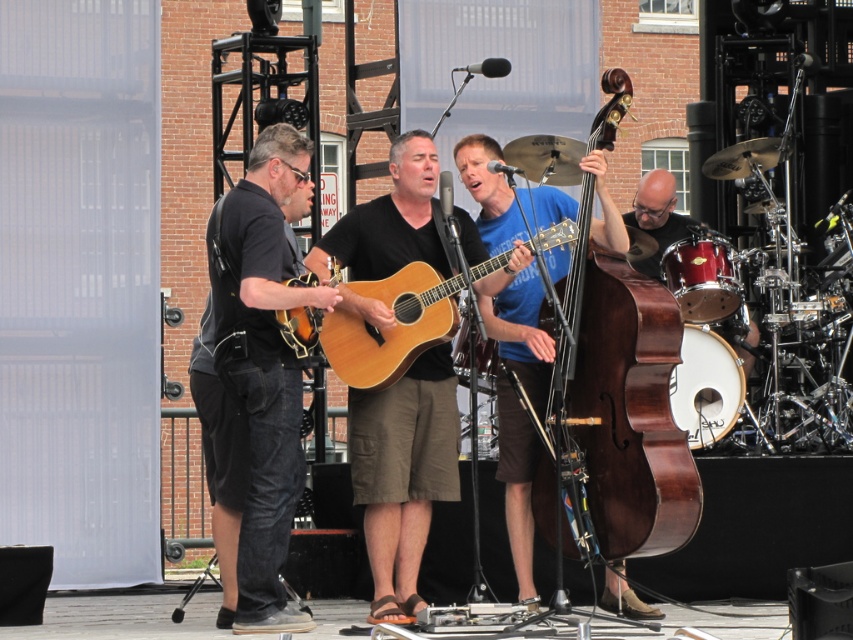
Does natural wood acoustic guitar at center come behind shiny black drum at right?

No, it is not.

Consider the image. Who is positioned more to the left, natural wood acoustic guitar at center or shiny black drum at right?

Positioned to the left is natural wood acoustic guitar at center.

The height and width of the screenshot is (640, 853). In order to click on natural wood acoustic guitar at center in this screenshot , I will do [x=393, y=326].

Is point (606, 115) behind point (259, 211)?

That is True.

Between brown polished wood cello at right and denim jeans at left, which one appears on the left side from the viewer's perspective?

denim jeans at left

Who is more distant from viewer, (x=628, y=294) or (x=286, y=536)?

Point (x=628, y=294)

Identify the location of brown polished wood cello at right. Image resolution: width=853 pixels, height=640 pixels. (618, 412).

Is matte wood guitar at center taller than shiny black drum at right?

No, matte wood guitar at center is not taller than shiny black drum at right.

Does matte wood guitar at center have a lesser height compared to shiny black drum at right?

Yes, matte wood guitar at center is shorter than shiny black drum at right.

Image resolution: width=853 pixels, height=640 pixels. In order to click on matte wood guitar at center in this screenshot , I will do `click(403, 474)`.

This screenshot has width=853, height=640. I want to click on matte wood guitar at center, so click(403, 474).